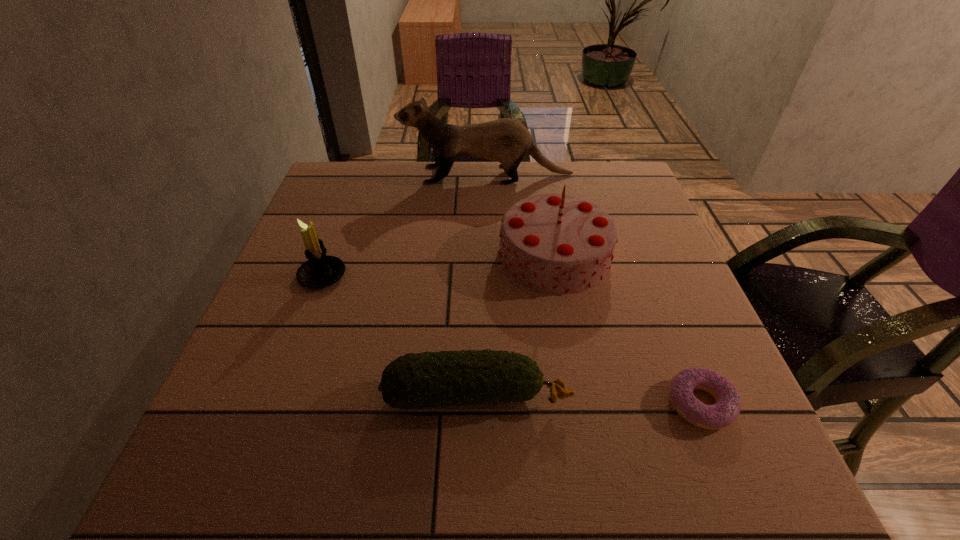
In order to click on vacant space located 0.120m on the back of the candle holder in this screenshot , I will do `click(340, 228)`.

Where is `vacant space located at the blossom end of the cucumber`? The width and height of the screenshot is (960, 540). vacant space located at the blossom end of the cucumber is located at coordinates (657, 395).

The image size is (960, 540). Identify the location of free space located 0.310m on the left of the doughnut. (481, 404).

Locate an element on the screen. Image resolution: width=960 pixels, height=540 pixels. object at the far edge is located at coordinates (505, 140).

I want to click on object that is at the left edge, so click(320, 270).

Identify the location of birthday cake present at the right edge. Image resolution: width=960 pixels, height=540 pixels. click(x=560, y=244).

This screenshot has width=960, height=540. I want to click on doughnut that is at the right edge, so click(x=725, y=411).

Image resolution: width=960 pixels, height=540 pixels. In the image, there is a desktop. In order to click on vacant area at the far edge in this screenshot , I will do `click(493, 173)`.

Identify the location of free space at the near edge of the desktop. The height and width of the screenshot is (540, 960). (x=326, y=494).

I want to click on vacant space at the left edge of the desktop, so click(x=277, y=424).